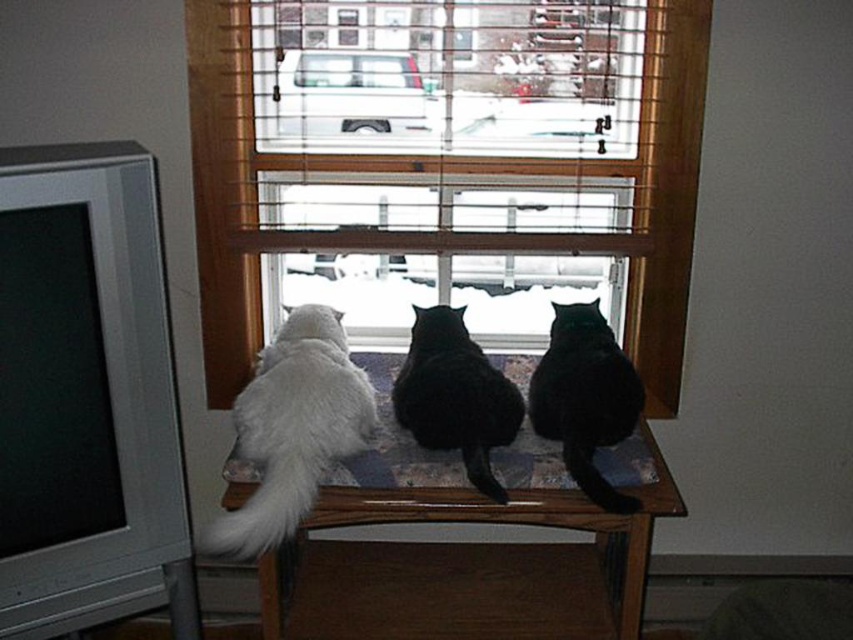
Does point (488, 428) come behind point (579, 410)?

No.

Does black glossy cat at center appear over black fur cat at center?

Correct, black glossy cat at center is located above black fur cat at center.

Find the location of a particular element. The width and height of the screenshot is (853, 640). black glossy cat at center is located at coordinates tap(456, 396).

This screenshot has width=853, height=640. Find the location of `black glossy cat at center`. black glossy cat at center is located at coordinates (456, 396).

Measure the distance between wooden frame at center and black fur cat at center.

wooden frame at center is 14.60 inches away from black fur cat at center.

From the picture: Can you confirm if wooden frame at center is positioned above black fur cat at center?

Correct, wooden frame at center is located above black fur cat at center.

Where is `wooden frame at center`? The image size is (853, 640). wooden frame at center is located at coordinates (444, 170).

Between wooden table at center and black fur cat at center, which one has less height?

black fur cat at center

Is wooden table at center thinner than black fur cat at center?

Incorrect, wooden table at center's width is not less than black fur cat at center's.

Locate an element on the screen. wooden table at center is located at coordinates (468, 547).